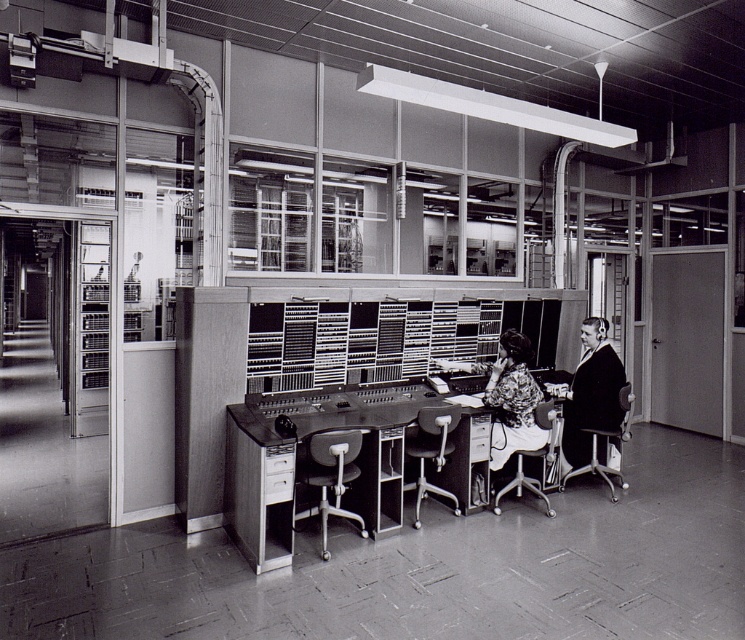
Looking at this image, who is positioned more to the right, floral-patterned fabric coat at center or dark wool coat at right?

dark wool coat at right is more to the right.

This screenshot has width=745, height=640. Find the location of `floral-patterned fabric coat at center`. floral-patterned fabric coat at center is located at coordinates (507, 397).

Identify the location of floral-patterned fabric coat at center. pos(507,397).

Does metallic desk at center appear over dark wool coat at right?

Actually, metallic desk at center is below dark wool coat at right.

Does point (259, 484) come behind point (568, 404)?

No.

Which is behind, point (240, 470) or point (602, 321)?

Point (602, 321)

Locate an element on the screen. metallic desk at center is located at coordinates (329, 461).

Who is higher up, metallic desk at center or floral-patterned fabric coat at center?

floral-patterned fabric coat at center is above.

Between point (342, 492) and point (523, 364), which one is positioned in front?

Point (342, 492) is more forward.

Locate an element on the screen. metallic desk at center is located at coordinates (329, 461).